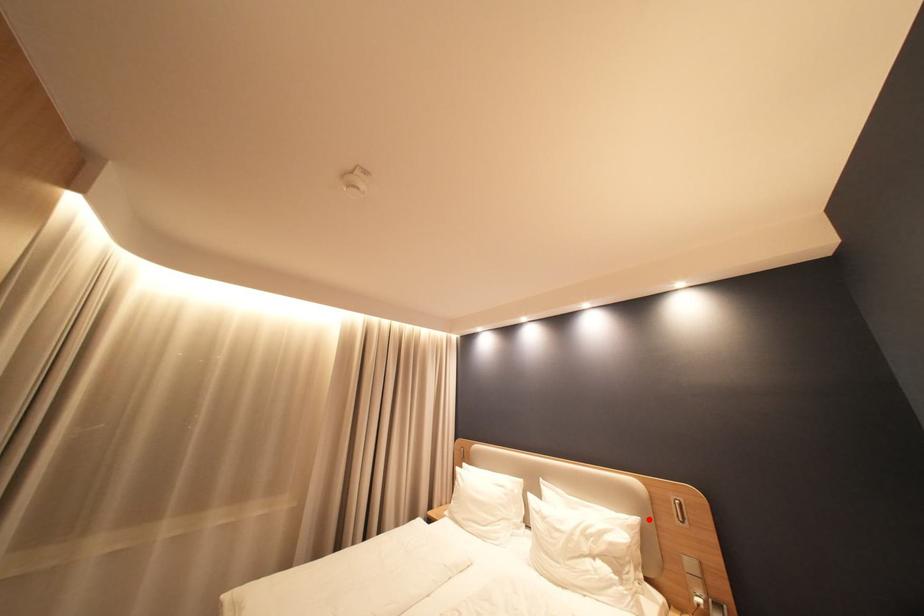
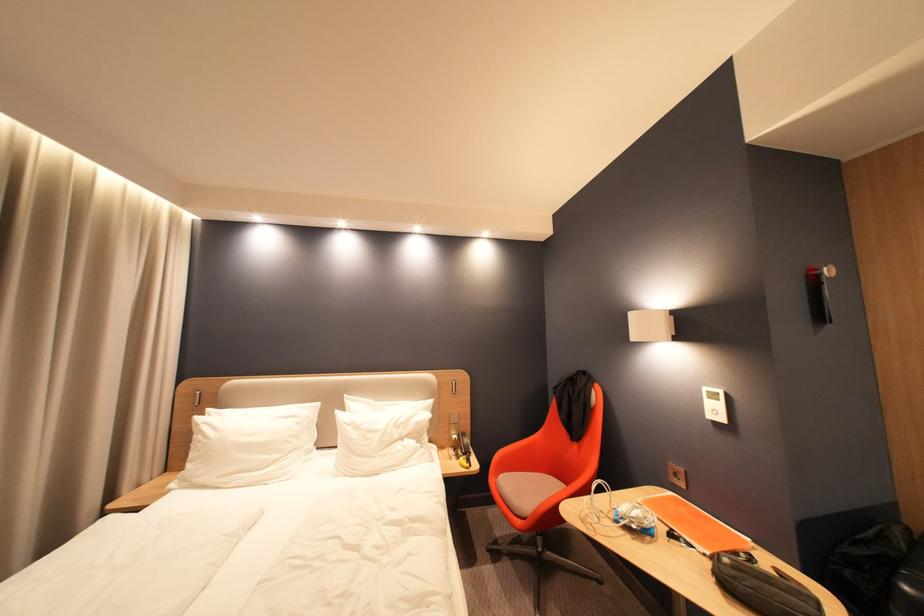
The point at the highlighted location is marked in the first image. Where is the corresponding point in the second image?

(443, 400)